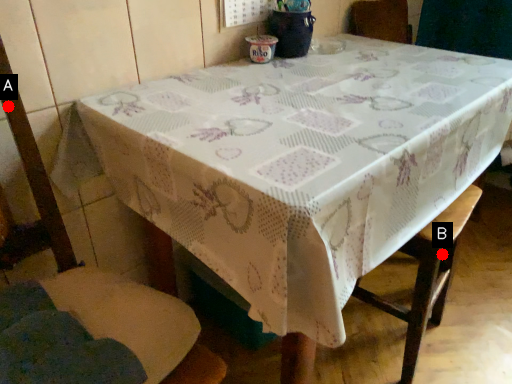
Question: Two points are circled on the image, labeled by A and B beside each circle. Which of the following is the farthest from the observer?

Choices:
 (A) A is further
 (B) B is further

Answer: (B)